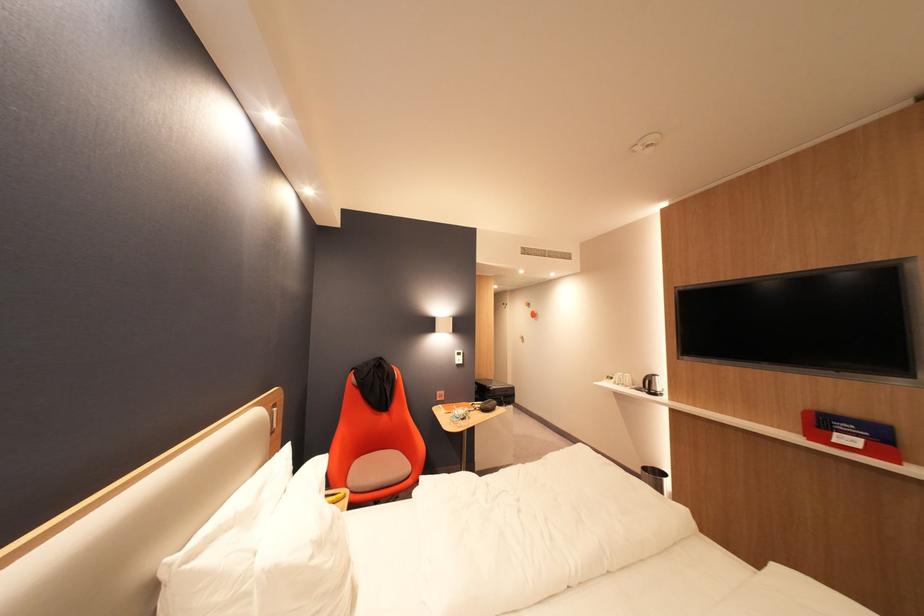
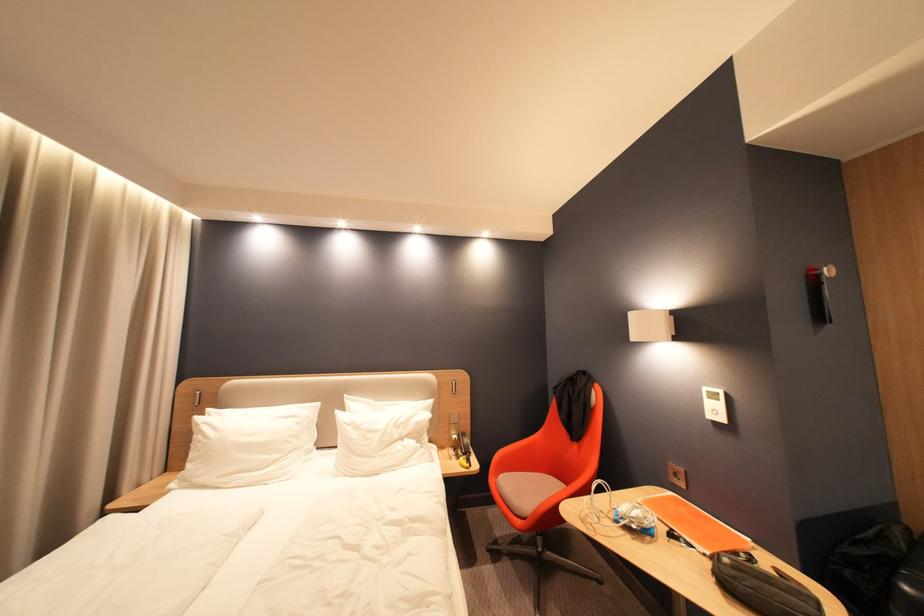
Locate, in the second image, the point that corresponds to pixel 469 428 in the first image.

(592, 523)